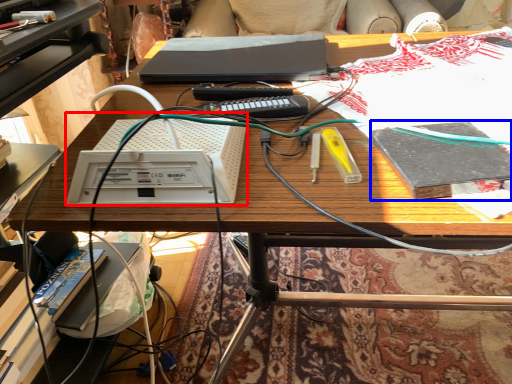
Question: Which object appears farthest to the camera in this image, equipment (highlighted by a red box) or book (highlighted by a blue box)?

Choices:
 (A) equipment
 (B) book

Answer: (B)